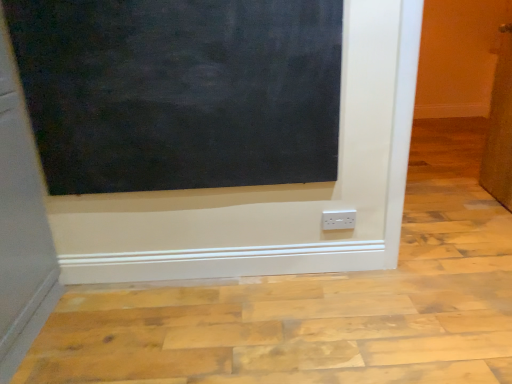
At what (x,y) coordinates should I click in order to perform the action: click on free area below brown textured door at right (from a real-world perspective). Please return your answer as a coordinate pair (x, y). Looking at the image, I should click on (490, 202).